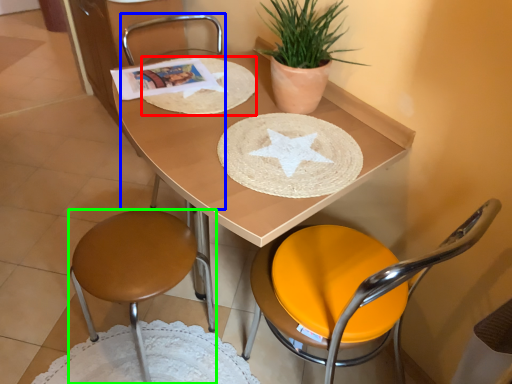
Question: Considering the real-world distances, which object is farthest from paper plate (highlighted by a red box)? chair (highlighted by a blue box) or chair (highlighted by a green box)?

Choices:
 (A) chair
 (B) chair

Answer: (A)